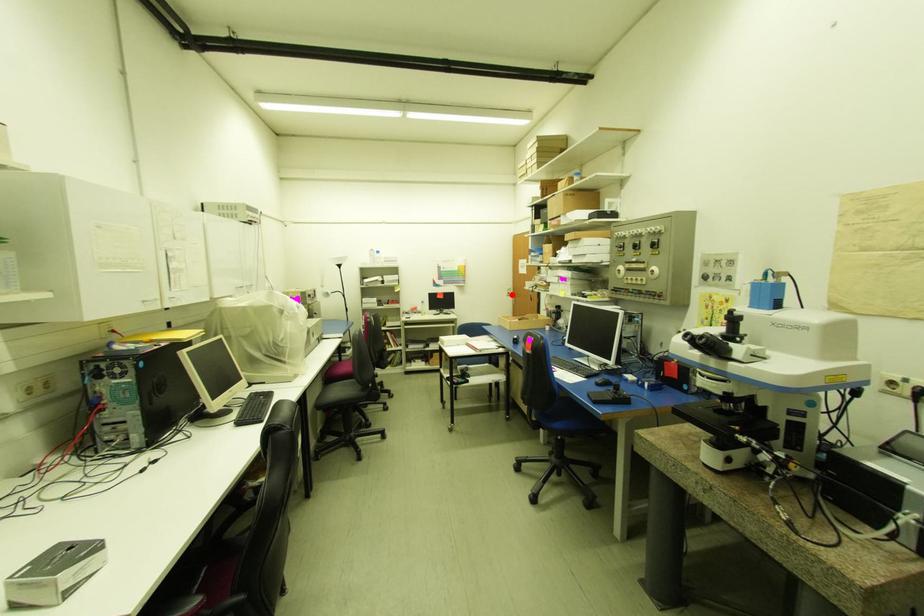
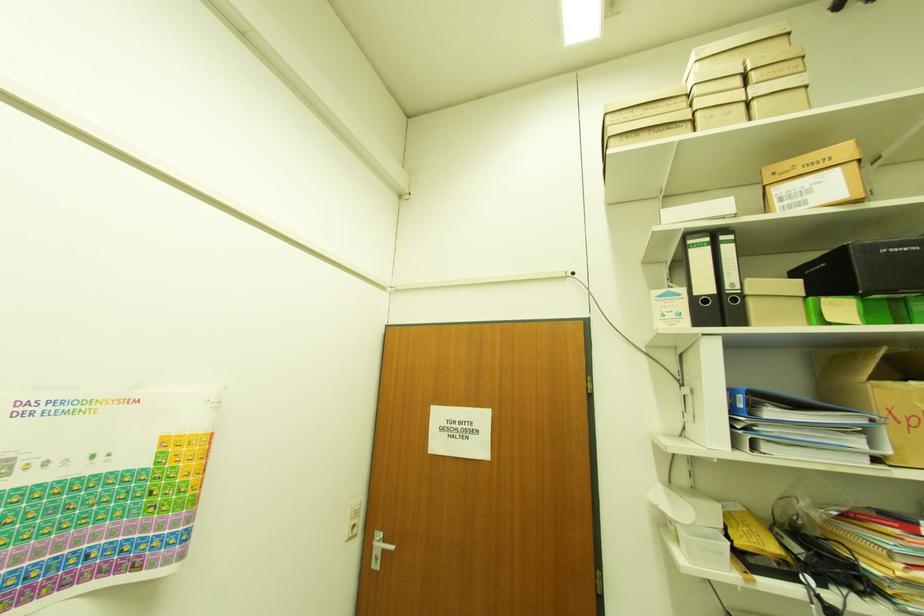
Question: I am providing you with two images of the same scene from different viewpoints. A red point is marked on the first image. Is the red point's position out of view in image 2?

Choices:
 (A) Yes
 (B) No

Answer: (B)